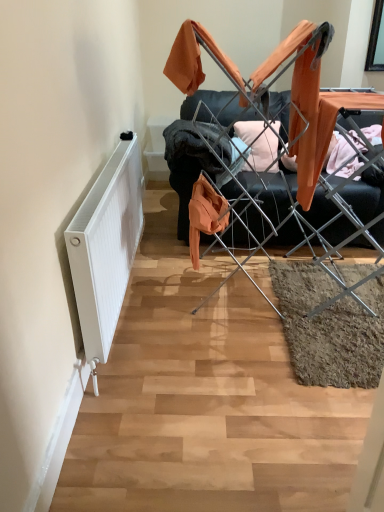
Question: Does white matte radiator at left contain metal drying rack at center?

Choices:
 (A) no
 (B) yes

Answer: (A)

Question: Is white matte radiator at left positioned far away from metal drying rack at center?

Choices:
 (A) yes
 (B) no

Answer: (B)

Question: Is white matte radiator at left to the left of metal drying rack at center from the viewer's perspective?

Choices:
 (A) no
 (B) yes

Answer: (B)

Question: Can you confirm if white matte radiator at left is thinner than metal drying rack at center?

Choices:
 (A) no
 (B) yes

Answer: (B)

Question: Does white matte radiator at left appear on the right side of metal drying rack at center?

Choices:
 (A) yes
 (B) no

Answer: (B)

Question: Is white matte radiator at left turned away from metal drying rack at center?

Choices:
 (A) no
 (B) yes

Answer: (A)

Question: Does orange fabric at center have a greater height compared to metal drying rack at center?

Choices:
 (A) no
 (B) yes

Answer: (A)

Question: Is orange fabric at center directly adjacent to metal drying rack at center?

Choices:
 (A) yes
 (B) no

Answer: (B)

Question: Is metal drying rack at center at the back of orange fabric at center?

Choices:
 (A) no
 (B) yes

Answer: (A)

Question: Considering the relative sizes of orange fabric at center and metal drying rack at center in the image provided, is orange fabric at center wider than metal drying rack at center?

Choices:
 (A) no
 (B) yes

Answer: (A)

Question: From a real-world perspective, is orange fabric at center on metal drying rack at center?

Choices:
 (A) yes
 (B) no

Answer: (B)

Question: Would you say metal drying rack at center is part of orange fabric at center's contents?

Choices:
 (A) no
 (B) yes

Answer: (A)

Question: Can you confirm if metal drying rack at center is thinner than white matte radiator at left?

Choices:
 (A) yes
 (B) no

Answer: (B)